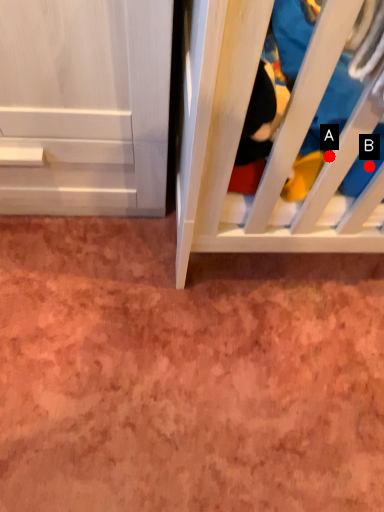
Question: Two points are circled on the image, labeled by A and B beside each circle. Among these points, which one is nearest to the camera?

Choices:
 (A) A is closer
 (B) B is closer

Answer: (A)